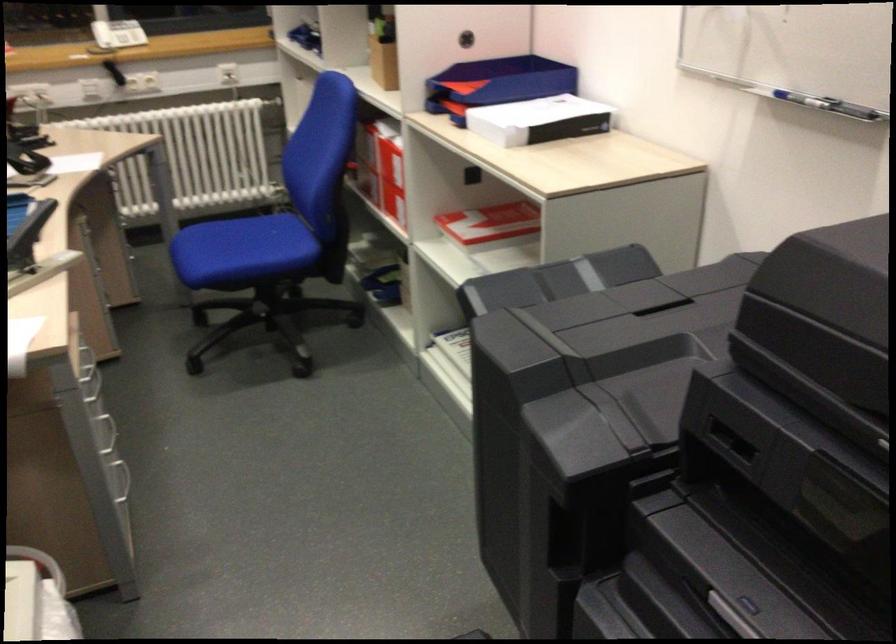
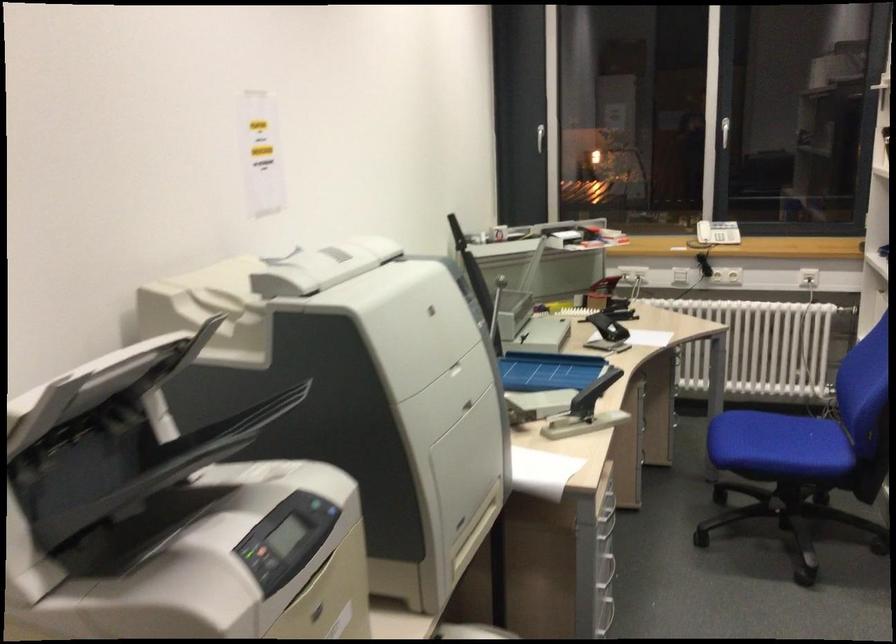
In the second image, find the point that corresponds to pixel 106 424 in the first image.

(604, 556)